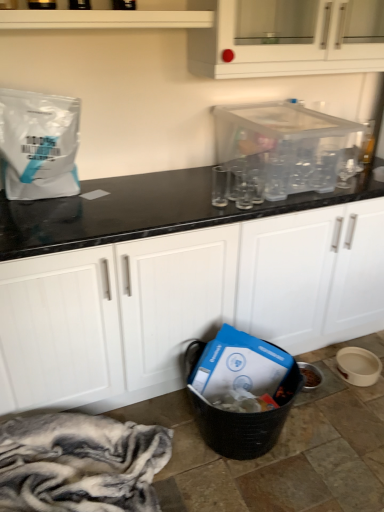
Question: Is white matte paper bag at upper left not within white glossy shelf at upper center?

Choices:
 (A) yes
 (B) no

Answer: (A)

Question: Considering the relative positions of white matte paper bag at upper left and white glossy shelf at upper center in the image provided, is white matte paper bag at upper left in front of white glossy shelf at upper center?

Choices:
 (A) yes
 (B) no

Answer: (B)

Question: Is white matte paper bag at upper left further to the viewer compared to white glossy shelf at upper center?

Choices:
 (A) yes
 (B) no

Answer: (A)

Question: From the image's perspective, is white matte paper bag at upper left under white glossy shelf at upper center?

Choices:
 (A) yes
 (B) no

Answer: (A)

Question: Does white matte paper bag at upper left have a greater height compared to white glossy shelf at upper center?

Choices:
 (A) no
 (B) yes

Answer: (B)

Question: Is white matte paper bag at upper left smaller than white glossy shelf at upper center?

Choices:
 (A) no
 (B) yes

Answer: (A)

Question: From a real-world perspective, is white glossy shelf at upper center on top of transparent plastic container at upper center?

Choices:
 (A) yes
 (B) no

Answer: (A)

Question: From the image's perspective, is white glossy shelf at upper center on transparent plastic container at upper center?

Choices:
 (A) yes
 (B) no

Answer: (A)

Question: Does white glossy shelf at upper center turn towards transparent plastic container at upper center?

Choices:
 (A) no
 (B) yes

Answer: (A)

Question: Are white glossy shelf at upper center and transparent plastic container at upper center located far from each other?

Choices:
 (A) no
 (B) yes

Answer: (A)

Question: Would you say white glossy shelf at upper center contains transparent plastic container at upper center?

Choices:
 (A) no
 (B) yes

Answer: (A)

Question: Is white glossy shelf at upper center directly adjacent to transparent plastic container at upper center?

Choices:
 (A) yes
 (B) no

Answer: (B)

Question: Is white glossy cabinet at upper center, which appears as the 1th cabinetry when viewed from the top, shorter than white glossy shelf at upper center?

Choices:
 (A) no
 (B) yes

Answer: (A)